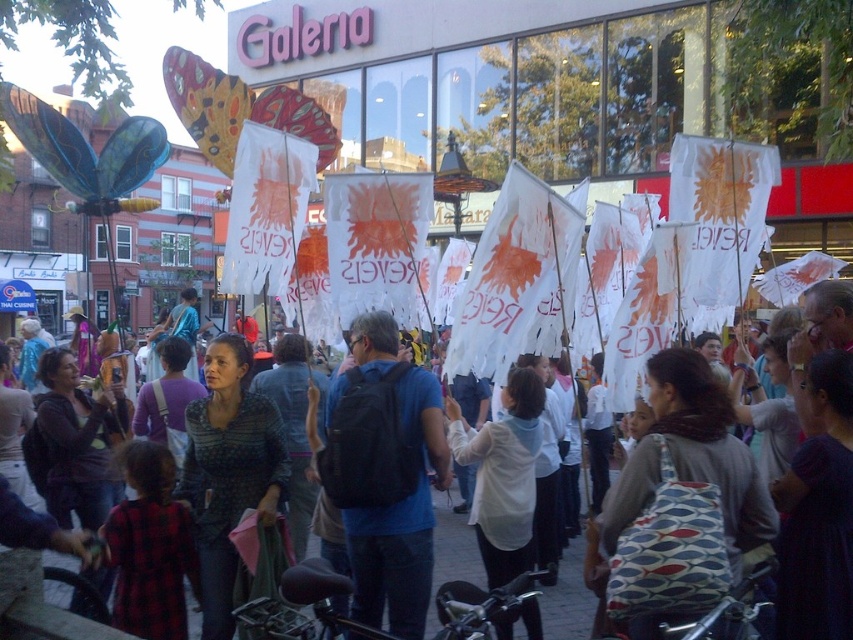
Is white matte shirt at center to the left of white paper flags at center from the viewer's perspective?

Correct, you'll find white matte shirt at center to the left of white paper flags at center.

Which is more to the left, white matte shirt at center or white paper flags at center?

white matte shirt at center

Is point (532, 488) less distant than point (451, 547)?

Yes.

This screenshot has height=640, width=853. In order to click on white matte shirt at center in this screenshot , I will do `click(503, 474)`.